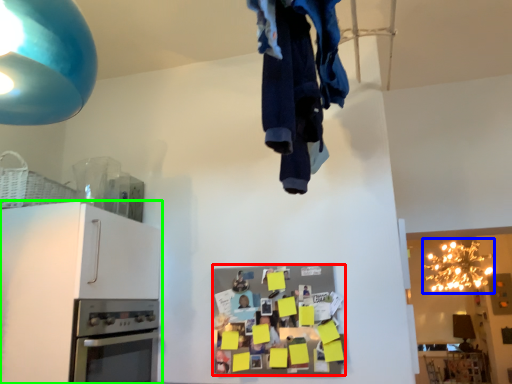
Question: Which object is the closest to the appliance (highlighted by a red box)? Choose among these: lamp (highlighted by a blue box) or cabinetry (highlighted by a green box).

Choices:
 (A) lamp
 (B) cabinetry

Answer: (B)